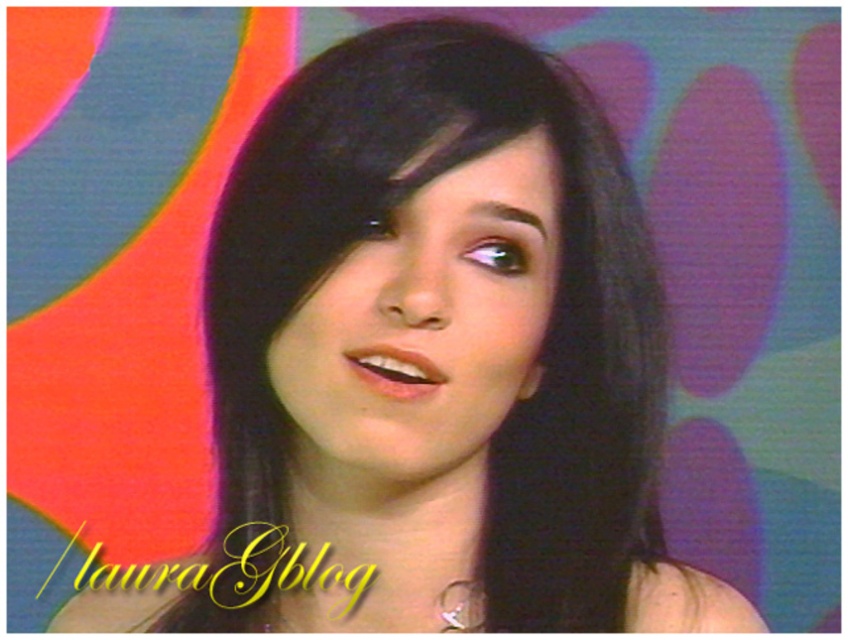
Question: Among these points, which one is nearest to the camera?

Choices:
 (A) (542, 365)
 (B) (530, 154)

Answer: (B)

Question: Is smooth skin face at center positioned behind silver metallic earring at lower center?

Choices:
 (A) yes
 (B) no

Answer: (B)

Question: Can you confirm if smooth skin face at center is wider than silver metallic earring at lower center?

Choices:
 (A) yes
 (B) no

Answer: (A)

Question: Does smooth skin face at center have a lesser width compared to silver metallic earring at lower center?

Choices:
 (A) no
 (B) yes

Answer: (A)

Question: Which point appears closest to the camera in this image?

Choices:
 (A) (530, 394)
 (B) (272, 349)

Answer: (B)